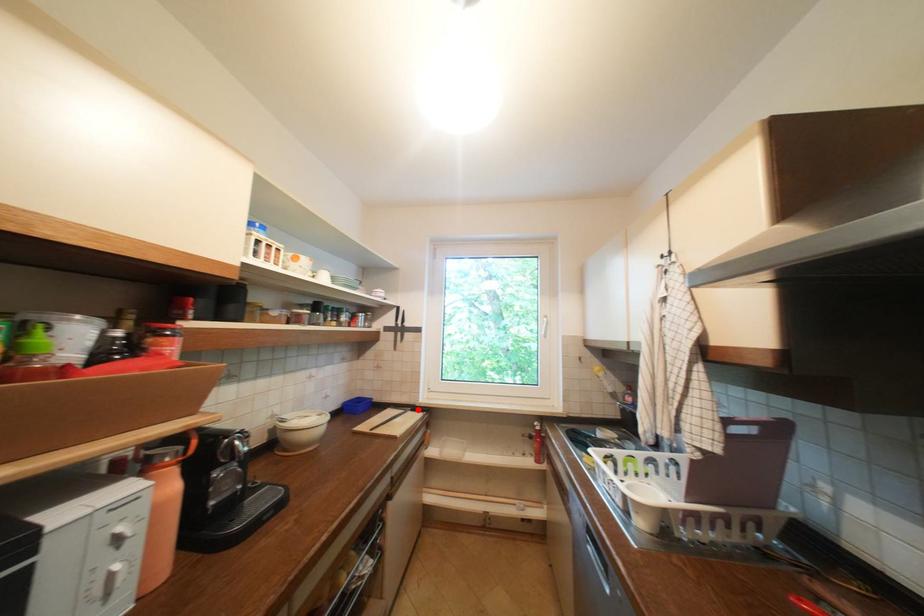
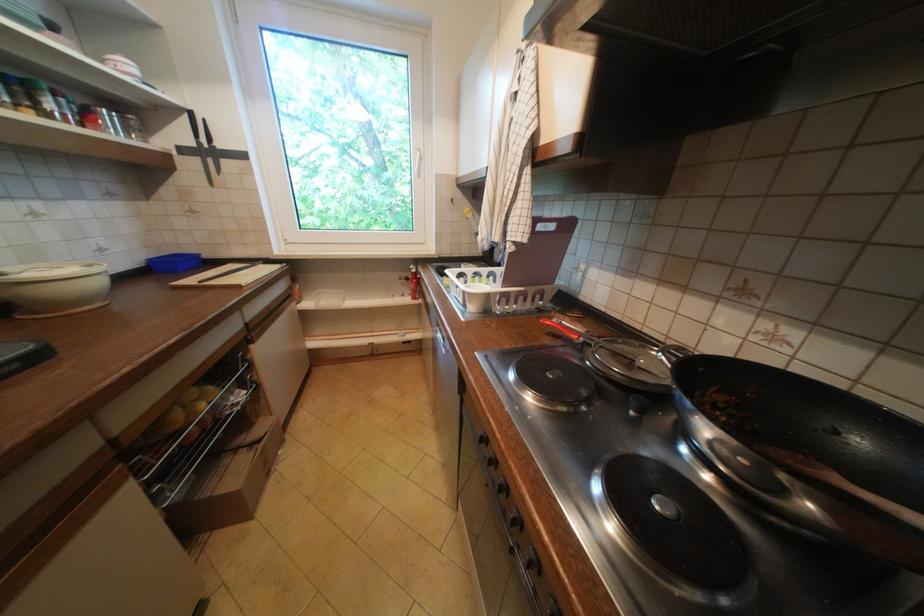
Question: I am providing you with two images of the same scene from different viewpoints. Given a red point in image1, look at the same physical point in image2. Is it:

Choices:
 (A) Closer to the viewpoint
 (B) Farther from the viewpoint

Answer: (A)